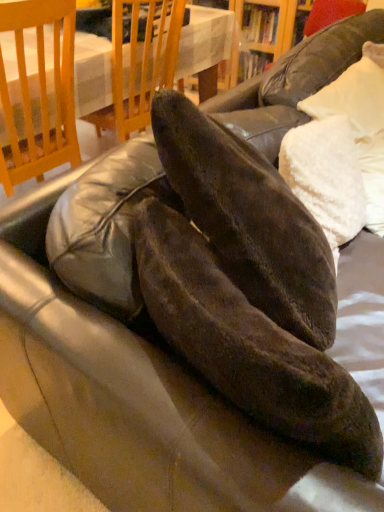
Question: Is wooden table at upper center taller or shorter than white fluffy pillow at upper right?

Choices:
 (A) tall
 (B) short

Answer: (A)

Question: Is wooden table at upper center inside or outside of white fluffy pillow at upper right?

Choices:
 (A) inside
 (B) outside

Answer: (B)

Question: Which of these objects is positioned farthest from the matte black shoe at center?

Choices:
 (A) white fluffy pillow at upper right
 (B) wooden table at upper center

Answer: (B)

Question: Which object is the farthest from the white fluffy pillow at upper right?

Choices:
 (A) wooden table at upper center
 (B) matte black shoe at center

Answer: (A)